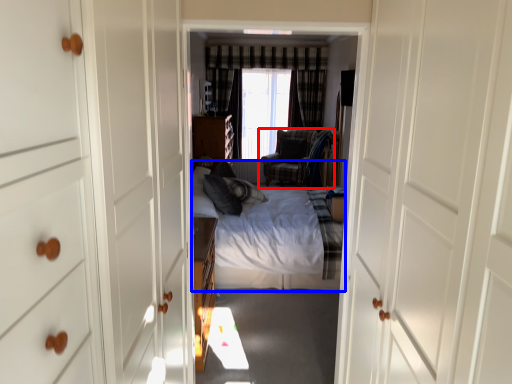
Question: Which of the following is the closest to the observer, chair (highlighted by a red box) or bed (highlighted by a blue box)?

Choices:
 (A) chair
 (B) bed

Answer: (B)